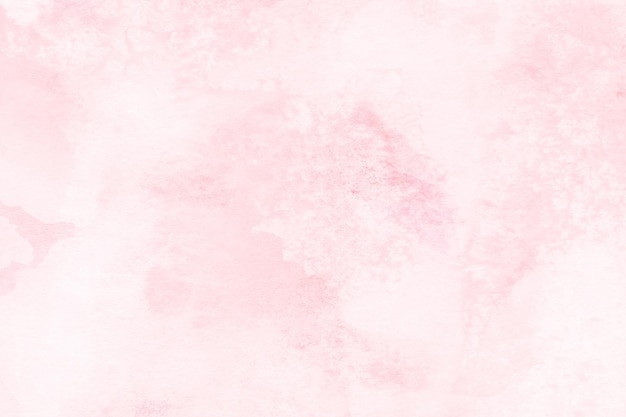
Where is `pink patterned surface`? The height and width of the screenshot is (417, 626). pink patterned surface is located at coordinates (294, 211).